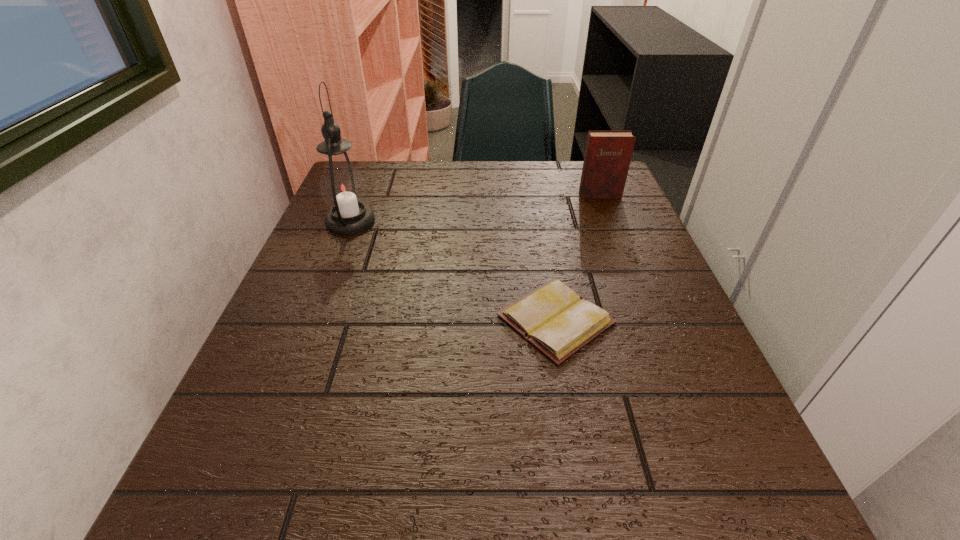
Where is `object located in the left edge section of the desktop`? The width and height of the screenshot is (960, 540). object located in the left edge section of the desktop is located at coordinates (342, 186).

Image resolution: width=960 pixels, height=540 pixels. In order to click on object located at the far right corner in this screenshot , I will do `click(607, 158)`.

You are a GUI agent. You are given a task and a screenshot of the screen. Output one action in this format:
    pyautogui.click(x=<x>, y=<y>)
    Task: Click on the vacant space at the far edge
    The width and height of the screenshot is (960, 540).
    Given the screenshot: What is the action you would take?
    pyautogui.click(x=419, y=160)

You are a GUI agent. You are given a task and a screenshot of the screen. Output one action in this format:
    pyautogui.click(x=<x>, y=<y>)
    Task: Click on the vacant space at the near edge of the desktop
    
    Given the screenshot: What is the action you would take?
    pyautogui.click(x=551, y=488)

I want to click on free space at the left edge of the desktop, so click(x=356, y=258).

Identify the location of vacant space at the right edge of the desktop. Image resolution: width=960 pixels, height=540 pixels. (715, 410).

Find the location of a particular element. This screenshot has height=540, width=960. free space at the far left corner of the desktop is located at coordinates point(376,179).

Image resolution: width=960 pixels, height=540 pixels. I want to click on free point at the far right corner, so tap(609, 200).

Identify the location of vacant area between the shorter diary and the second farthest object. (453, 271).

Locate an element on the screen. vacant space that's between the second nearest object and the farthest object is located at coordinates (475, 208).